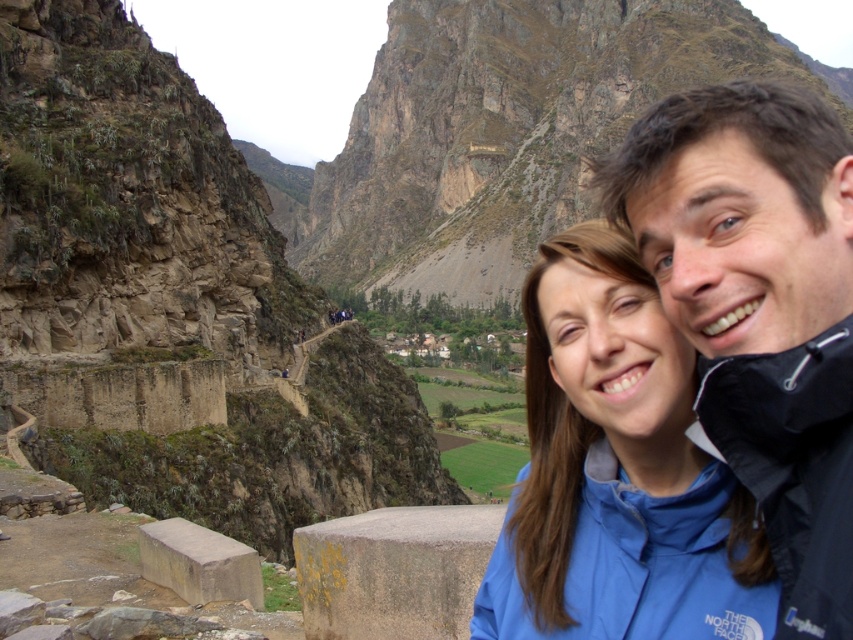
Question: Which point is closer to the camera?

Choices:
 (A) (753, 257)
 (B) (827, 355)

Answer: (B)

Question: Which point is farther to the camera?

Choices:
 (A) (850, 454)
 (B) (735, 266)
 (C) (497, 216)
 (D) (643, 596)

Answer: (C)

Question: Is the position of blue fabric jacket at right less distant than that of dark blue nylon jacket at upper right?

Choices:
 (A) no
 (B) yes

Answer: (B)

Question: Does blue fabric jacket at right come behind dark blue nylon jacket at upper right?

Choices:
 (A) yes
 (B) no

Answer: (B)

Question: Is blue fabric jacket at right closer to camera compared to blue fabric jacket at center?

Choices:
 (A) no
 (B) yes

Answer: (B)

Question: Among these objects, which one is nearest to the camera?

Choices:
 (A) blue fabric jacket at center
 (B) dark blue nylon jacket at upper right
 (C) blue fabric jacket at right

Answer: (C)